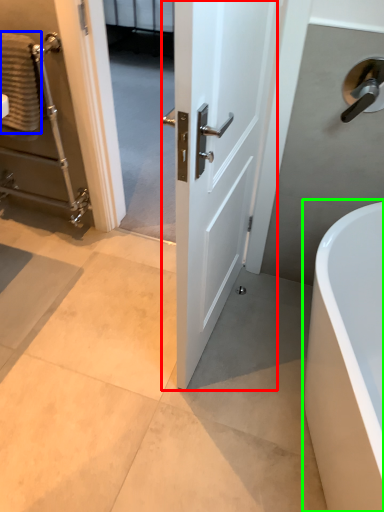
Question: Based on their relative distances, which object is nearer to door (highlighted by a red box)? Choose from material (highlighted by a blue box) and bathtub (highlighted by a green box).

Choices:
 (A) material
 (B) bathtub

Answer: (B)